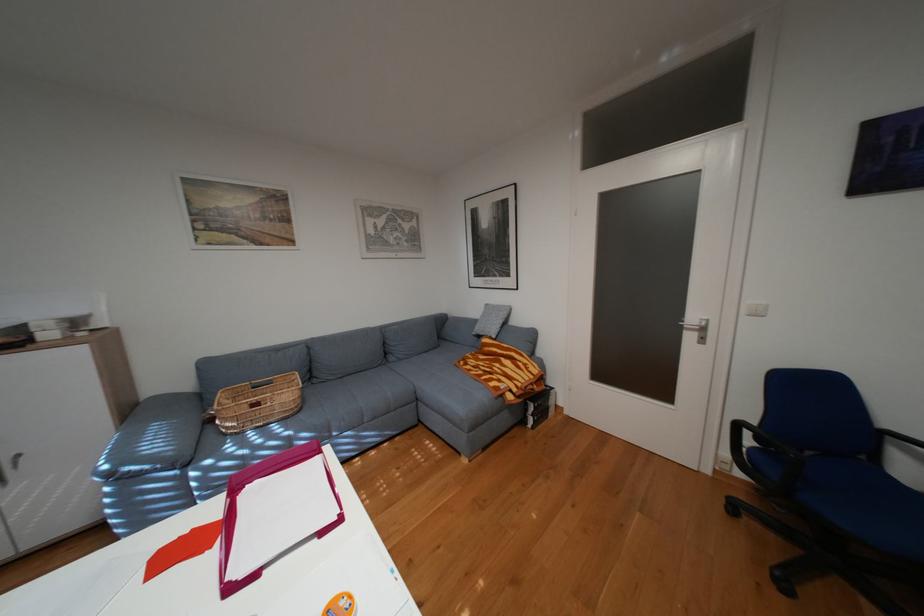
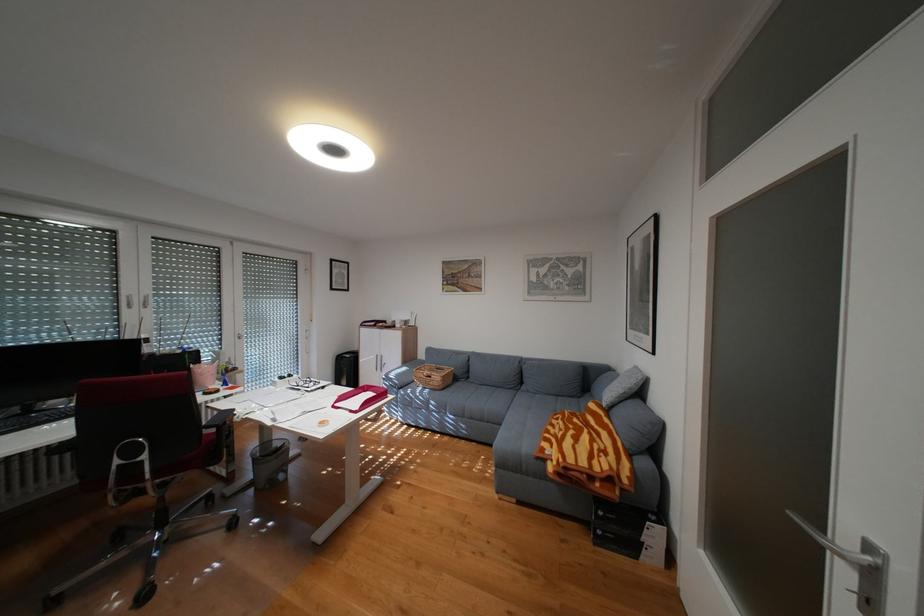
Locate, in the second image, the point that corresponds to point (241, 589) in the first image.

(346, 406)